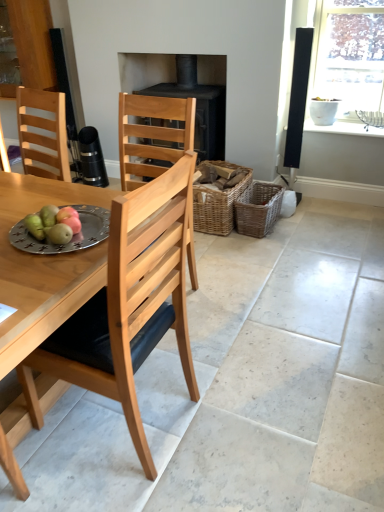
In order to click on vacant area that is in front of woven brown basket at center-right, acting as the 1th basket starting from the right in this screenshot , I will do `click(265, 247)`.